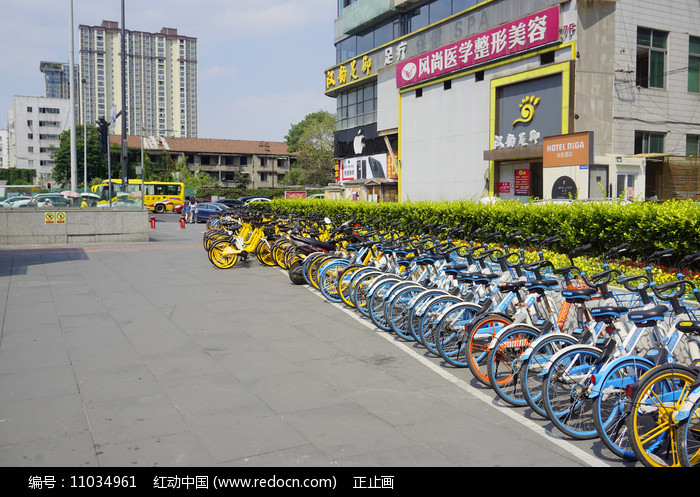
Find the location of a particular element. windows is located at coordinates (648, 63), (645, 146), (691, 142).